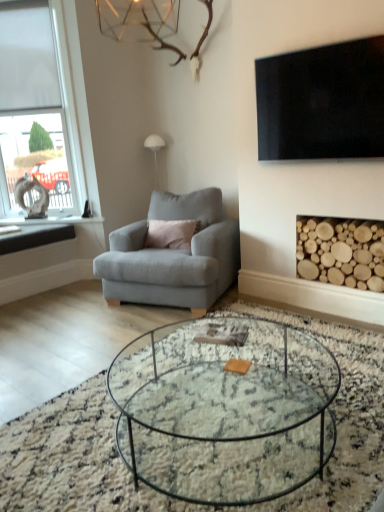
Question: Is matte gray armchair at center thinner than clear glass coffee table at center?

Choices:
 (A) no
 (B) yes

Answer: (B)

Question: Is matte gray armchair at center touching clear glass coffee table at center?

Choices:
 (A) no
 (B) yes

Answer: (A)

Question: Considering the relative positions of matte gray armchair at center and clear glass coffee table at center in the image provided, is matte gray armchair at center behind clear glass coffee table at center?

Choices:
 (A) no
 (B) yes

Answer: (B)

Question: Does matte gray armchair at center have a larger size compared to clear glass coffee table at center?

Choices:
 (A) no
 (B) yes

Answer: (B)

Question: Is matte gray armchair at center outside clear glass coffee table at center?

Choices:
 (A) yes
 (B) no

Answer: (A)

Question: Is matte gray armchair at center smaller than clear glass coffee table at center?

Choices:
 (A) no
 (B) yes

Answer: (A)

Question: Is black glossy tv at upper right placed right next to white frosted glass window at left?

Choices:
 (A) yes
 (B) no

Answer: (B)

Question: Would you say black glossy tv at upper right contains white frosted glass window at left?

Choices:
 (A) no
 (B) yes

Answer: (A)

Question: From the image's perspective, is black glossy tv at upper right over white frosted glass window at left?

Choices:
 (A) no
 (B) yes

Answer: (A)

Question: Considering the relative positions of black glossy tv at upper right and white frosted glass window at left in the image provided, is black glossy tv at upper right to the left of white frosted glass window at left from the viewer's perspective?

Choices:
 (A) no
 (B) yes

Answer: (A)

Question: From a real-world perspective, is black glossy tv at upper right on top of white frosted glass window at left?

Choices:
 (A) yes
 (B) no

Answer: (B)

Question: Is black glossy tv at upper right turned away from white frosted glass window at left?

Choices:
 (A) no
 (B) yes

Answer: (A)

Question: Is black glossy tv at upper right far from clear glass coffee table at center?

Choices:
 (A) yes
 (B) no

Answer: (A)